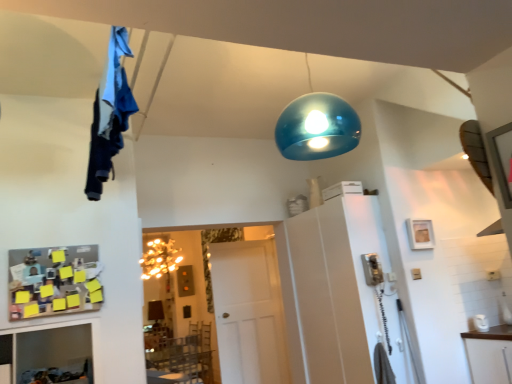
Locate an element on the screen. This screenshot has height=384, width=512. white matte door at center is located at coordinates (249, 313).

What is the approximate height of blue fabric at upper left?

It is 18.75 inches.

What do you see at coordinates (109, 114) in the screenshot? I see `blue fabric at upper left` at bounding box center [109, 114].

At what (x,y) coordinates should I click in order to perform the action: click on wooden pegboard with sticky notes at lower left. Please return your answer as a coordinate pair (x, y). This screenshot has height=384, width=512. Looking at the image, I should click on (54, 281).

Measure the distance between white glossy cabinet at right and camera.

white glossy cabinet at right and camera are 10.83 feet apart.

The image size is (512, 384). What do you see at coordinates (420, 234) in the screenshot? I see `wooden picture frame at upper right` at bounding box center [420, 234].

Locate an element on the screen. white matte door at center is located at coordinates (249, 313).

Between white matte door at center and wooden picture frame at upper right, which one has larger size?

With larger size is white matte door at center.

Can you tell me how much white matte door at center and wooden picture frame at upper right differ in facing direction?

0.0669 degrees separate the facing orientations of white matte door at center and wooden picture frame at upper right.

Which of these two, white matte door at center or wooden picture frame at upper right, is wider?

With larger width is white matte door at center.

From a real-world perspective, does blue fabric at upper left sit lower than wooden pegboard with sticky notes at lower left?

No, from a real-world perspective, blue fabric at upper left is not beneath wooden pegboard with sticky notes at lower left.

Would you consider blue fabric at upper left to be distant from wooden pegboard with sticky notes at lower left?

No, blue fabric at upper left is in close proximity to wooden pegboard with sticky notes at lower left.

Consider the image. Who is bigger, white matte door at center or wooden pegboard with sticky notes at lower left?

Bigger between the two is white matte door at center.

Considering the sizes of objects white matte door at center and wooden pegboard with sticky notes at lower left in the image provided, who is thinner, white matte door at center or wooden pegboard with sticky notes at lower left?

With smaller width is wooden pegboard with sticky notes at lower left.

From the image's perspective, is white matte door at center below wooden pegboard with sticky notes at lower left?

Yes, from the image's perspective, white matte door at center is beneath wooden pegboard with sticky notes at lower left.

From a real-world perspective, is white matte door at center physically located above or below wooden pegboard with sticky notes at lower left?

In terms of real-world spatial position, white matte door at center is below wooden pegboard with sticky notes at lower left.

In the image, there is a wooden picture frame at upper right. Where is `cabinetry below it (from a real-world perspective)`? The height and width of the screenshot is (384, 512). cabinetry below it (from a real-world perspective) is located at coordinates (335, 286).

How many degrees apart are the facing directions of wooden picture frame at upper right and white glossy cabinet at right?

They differ by 89.1 degrees in their facing directions.

From a real-world perspective, between wooden picture frame at upper right and white glossy cabinet at right, who is vertically lower?

From a 3D spatial view, white glossy cabinet at right is below.

Could you tell me if wooden picture frame at upper right is turned towards white glossy cabinet at right?

No, wooden picture frame at upper right is not aimed at white glossy cabinet at right.

Which object is thinner, blue fabric at upper left or wooden picture frame at upper right?

With smaller width is wooden picture frame at upper right.

Which is closer, (111,98) or (408,225)?

Point (111,98) is positioned closer to the camera compared to point (408,225).

Considering the positions of objects blue fabric at upper left and wooden picture frame at upper right in the image provided, who is in front, blue fabric at upper left or wooden picture frame at upper right?

blue fabric at upper left.

Is wooden pegboard with sticky notes at lower left aimed at blue fabric at upper left?

No, wooden pegboard with sticky notes at lower left is not turned towards blue fabric at upper left.

Do you think wooden pegboard with sticky notes at lower left is within blue fabric at upper left, or outside of it?

wooden pegboard with sticky notes at lower left is located beyond the bounds of blue fabric at upper left.

Considering the relative positions of wooden pegboard with sticky notes at lower left and blue fabric at upper left in the image provided, is wooden pegboard with sticky notes at lower left to the right of blue fabric at upper left from the viewer's perspective?

In fact, wooden pegboard with sticky notes at lower left is to the left of blue fabric at upper left.

Locate an element on the screen. Image resolution: width=512 pixels, height=384 pixels. shelf behind the blue fabric at upper left is located at coordinates pyautogui.click(x=54, y=281).

Visually, is white matte door at center positioned to the left or to the right of blue fabric at upper left?

Based on their positions, white matte door at center is located to the right of blue fabric at upper left.

From a real-world perspective, who is located lower, white matte door at center or blue fabric at upper left?

white matte door at center.

In terms of width, does white matte door at center look wider or thinner when compared to blue fabric at upper left?

Clearly, white matte door at center has less width compared to blue fabric at upper left.

Where is `door located below the wooden picture frame at upper right (from the image's perspective)`? The width and height of the screenshot is (512, 384). door located below the wooden picture frame at upper right (from the image's perspective) is located at coordinates (249, 313).

The height and width of the screenshot is (384, 512). What are the coordinates of `laundry above the wooden pegboard with sticky notes at lower left (from a real-world perspective)` in the screenshot? It's located at (109, 114).

Estimate the real-world distances between objects in this image. Which object is closer to blue fabric at upper left, wooden picture frame at upper right or white glossy cabinet at right?

Among the two, white glossy cabinet at right is located nearer to blue fabric at upper left.

From the image, which object appears to be nearer to white glossy cabinet at right, wooden pegboard with sticky notes at lower left or white matte door at center?

white matte door at center is closer to white glossy cabinet at right.

When comparing their distances from blue fabric at upper left, does white matte door at center or white glossy cabinet at right seem further?

The object further to blue fabric at upper left is white matte door at center.

Which object lies further to the anchor point wooden picture frame at upper right, wooden pegboard with sticky notes at lower left or blue fabric at upper left?

Based on the image, wooden pegboard with sticky notes at lower left appears to be further to wooden picture frame at upper right.

From the image, which object appears to be nearer to white matte door at center, wooden pegboard with sticky notes at lower left or white glossy cabinet at right?

The object closer to white matte door at center is white glossy cabinet at right.

Consider the image. Estimate the real-world distances between objects in this image. Which object is closer to wooden pegboard with sticky notes at lower left, blue fabric at upper left or white glossy cabinet at right?

Based on the image, blue fabric at upper left appears to be nearer to wooden pegboard with sticky notes at lower left.

Based on their spatial positions, is white glossy cabinet at right or wooden pegboard with sticky notes at lower left closer to white matte door at center?

Among the two, white glossy cabinet at right is located nearer to white matte door at center.

Which object lies nearer to the anchor point white matte door at center, wooden picture frame at upper right or blue fabric at upper left?

Among the two, wooden picture frame at upper right is located nearer to white matte door at center.

Locate an element on the screen. The width and height of the screenshot is (512, 384). laundry between wooden pegboard with sticky notes at lower left and wooden picture frame at upper right is located at coordinates (109, 114).

At what (x,y) coordinates should I click in order to perform the action: click on cabinetry located between wooden pegboard with sticky notes at lower left and white matte door at center in the depth direction. Please return your answer as a coordinate pair (x, y). Looking at the image, I should click on (335, 286).

This screenshot has height=384, width=512. In order to click on picture frame located between white glossy cabinet at right and white matte door at center in the depth direction in this screenshot , I will do `click(420, 234)`.

Locate an element on the screen. This screenshot has width=512, height=384. picture frame located between blue fabric at upper left and white matte door at center in the depth direction is located at coordinates pos(420,234).